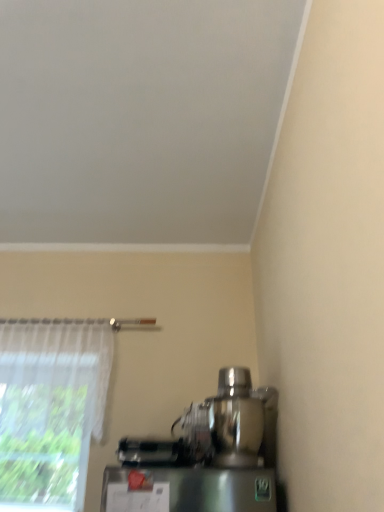
Question: Can you confirm if sheer white curtain at left is shorter than shiny metallic mixer at lower right?

Choices:
 (A) no
 (B) yes

Answer: (A)

Question: Is sheer white curtain at left taller than shiny metallic mixer at lower right?

Choices:
 (A) yes
 (B) no

Answer: (A)

Question: Does sheer white curtain at left have a larger size compared to shiny metallic mixer at lower right?

Choices:
 (A) yes
 (B) no

Answer: (A)

Question: From the image's perspective, does sheer white curtain at left appear lower than shiny metallic mixer at lower right?

Choices:
 (A) no
 (B) yes

Answer: (A)

Question: From the image's perspective, is sheer white curtain at left on top of shiny metallic mixer at lower right?

Choices:
 (A) no
 (B) yes

Answer: (B)

Question: Is sheer white curtain at left not inside shiny metallic mixer at lower right?

Choices:
 (A) no
 (B) yes

Answer: (B)

Question: Considering the relative positions of shiny metallic mixer at lower right and sheer white curtain at left in the image provided, is shiny metallic mixer at lower right to the right of sheer white curtain at left from the viewer's perspective?

Choices:
 (A) no
 (B) yes

Answer: (B)

Question: Is shiny metallic mixer at lower right taller than sheer white curtain at left?

Choices:
 (A) no
 (B) yes

Answer: (A)

Question: Is shiny metallic mixer at lower right to the left of sheer white curtain at left from the viewer's perspective?

Choices:
 (A) no
 (B) yes

Answer: (A)

Question: Can you confirm if shiny metallic mixer at lower right is bigger than sheer white curtain at left?

Choices:
 (A) yes
 (B) no

Answer: (B)

Question: Is shiny metallic mixer at lower right turned away from sheer white curtain at left?

Choices:
 (A) yes
 (B) no

Answer: (B)

Question: Is shiny metallic mixer at lower right placed right next to sheer white curtain at left?

Choices:
 (A) yes
 (B) no

Answer: (B)

Question: Considering the positions of sheer white curtain at left and shiny metallic mixer at lower right in the image, is sheer white curtain at left bigger or smaller than shiny metallic mixer at lower right?

Choices:
 (A) big
 (B) small

Answer: (A)